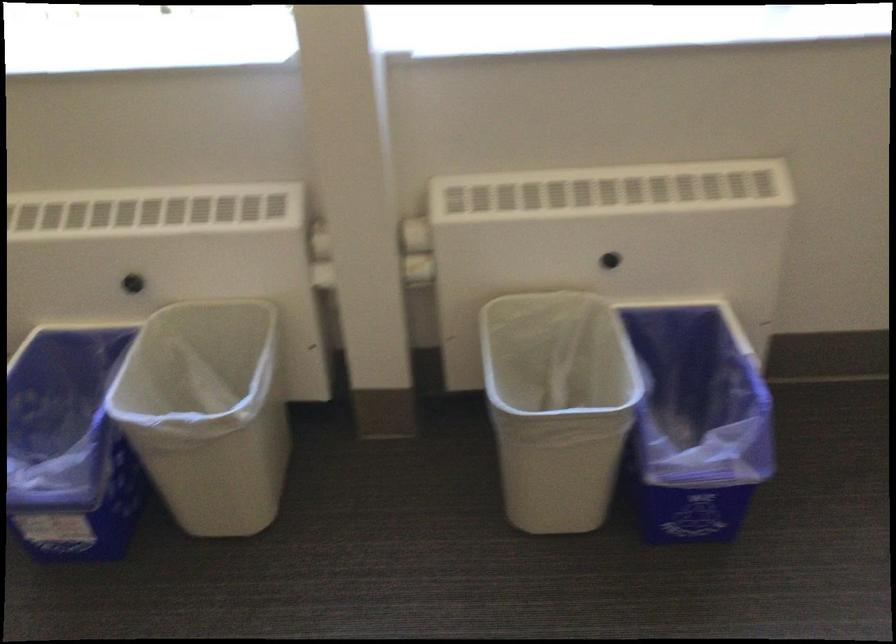
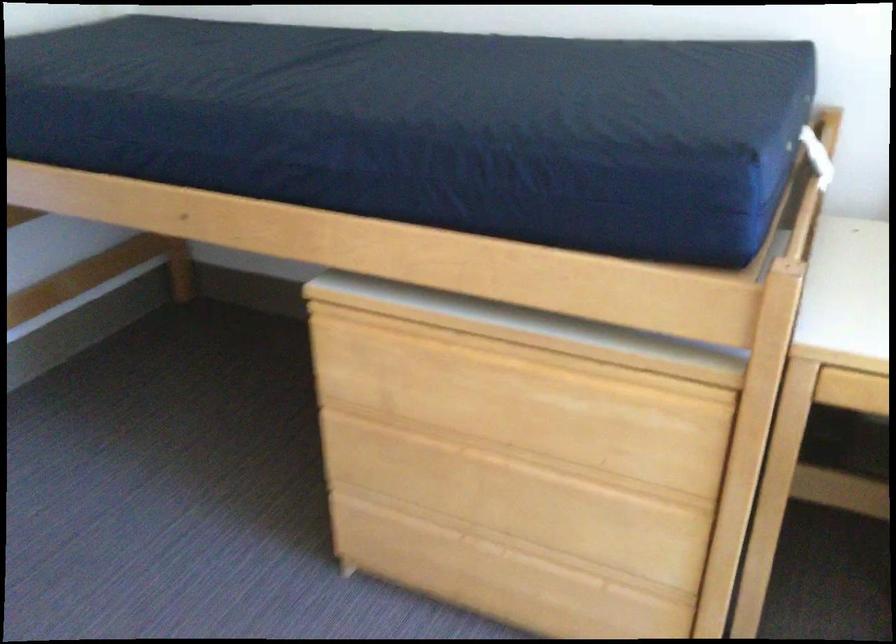
How did the camera likely rotate?

The camera rotated toward left-down.